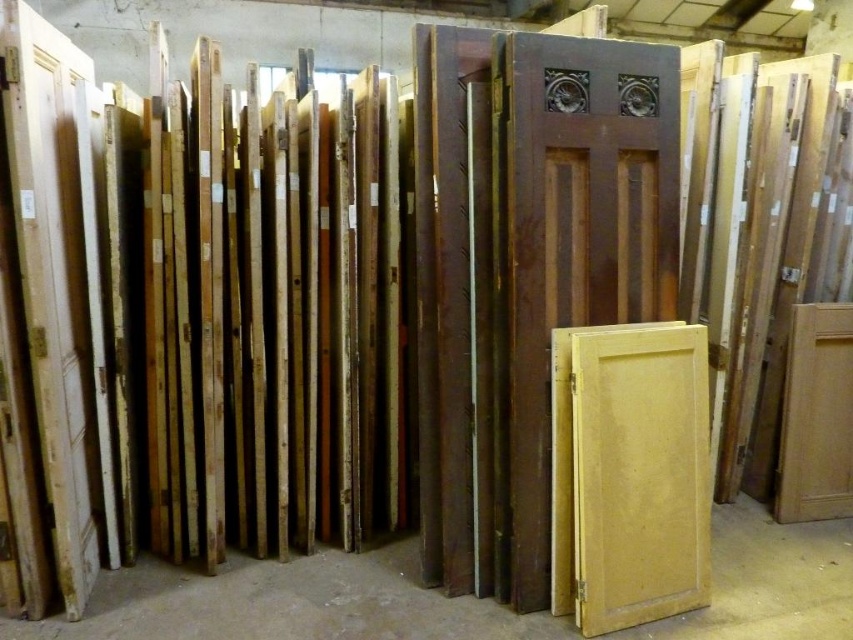
Question: Is matte brown wooden door at center above light yellow wood door at center?

Choices:
 (A) no
 (B) yes

Answer: (B)

Question: Is matte brown wooden door at center smaller than light yellow wood door at center?

Choices:
 (A) no
 (B) yes

Answer: (A)

Question: Which point is closer to the camera?

Choices:
 (A) light yellow wood door at center
 (B) matte brown wooden door at center

Answer: (B)

Question: Among these objects, which one is nearest to the camera?

Choices:
 (A) matte brown wooden door at center
 (B) light yellow wood door at center

Answer: (A)

Question: Observing the image, what is the correct spatial positioning of matte brown wooden door at center in reference to light yellow wood door at center?

Choices:
 (A) above
 (B) below

Answer: (A)

Question: Which point is farther to the camera?

Choices:
 (A) light yellow wood door at center
 (B) matte brown wooden door at center

Answer: (A)